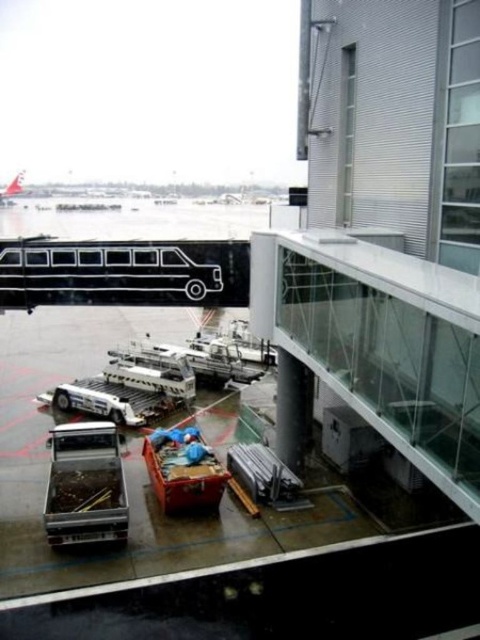
You are a baggage handler at the airport and need to move a 300 foot long cargo container from the black matte bus at upper left to the white glossy airplane at upper left. Is there enough space between them to maneuver the cargo container without any obstruction?

The black matte bus at upper left and the white glossy airplane at upper left are 302.13 feet apart. Since the cargo container is 300 feet long, there is enough space between them to maneuver the cargo container without obstruction.

You are standing at the glass walkway with metal railings in the airport terminal and want to board the airplane via the jet bridge. There is a black matte bus at upper left blocking your path. Is the bus close enough to the camera for you to have to move it before proceeding?

The black matte bus at upper left is 18.74 meters from the camera, which is a considerable distance away. Since it is not obstructing your immediate path to the jet bridge, you likely do not need to move it before proceeding.